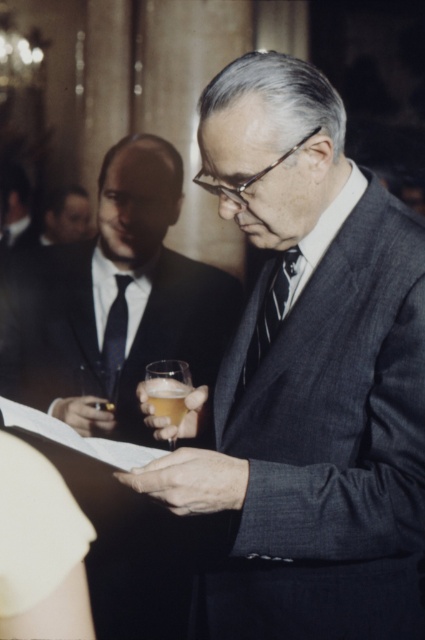
You are at a formal event and see two men in suits. One is wearing a gray wool suit at center and the other a dark suit at center. Which one is positioned more to the right?

The gray wool suit at center is positioned more to the right than the dark suit at center.

You are standing in the room and want to locate the striped fabric tie at center. Where would you look?

The striped fabric tie at center is located at the 2D coordinates point (x=268, y=317).

You are standing in the room and want to move from point (231, 588) to point (22, 212). Which direction should you move in?

You should move downward and to the left because point (22, 212) is located in the lower left relative to point (231, 588).